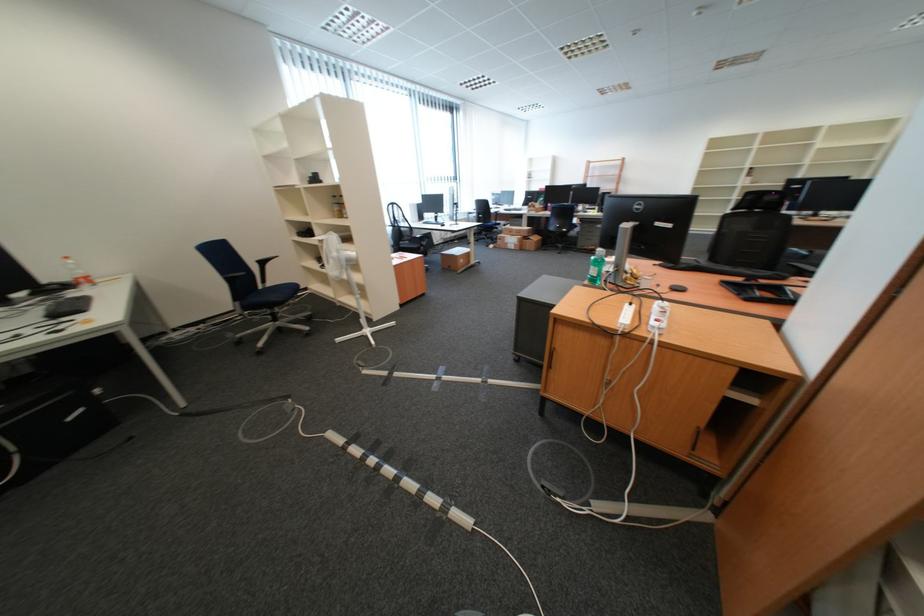
Identify the location of bottle pump head. The image size is (924, 616). (78, 272).